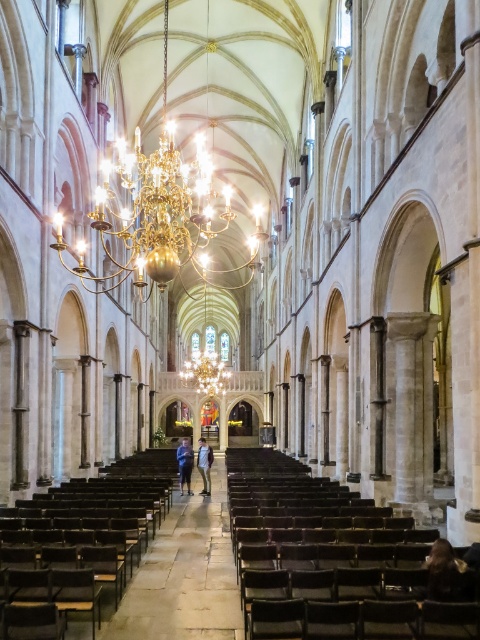
You are a visitor standing at the entrance of the cathedral. You see the brown wooden aisle at center and the blue denim jeans at center. Which object is bigger in size?

The brown wooden aisle at center is larger in size compared to the blue denim jeans at center.

You are standing in the cathedral and notice both the gold metallic chandelier at upper center and the light blue denim jeans at center. From your perspective, which object is located to the left?

The gold metallic chandelier at upper center is positioned on the left side of light blue denim jeans at center, so from your perspective, the gold metallic chandelier at upper center is to the left of the light blue denim jeans at center.

You are a visitor standing at the entrance of the cathedral. You notice the gold metallic chandelier at upper center and the light blue denim jeans at center. How far apart are these two items from each other?

The gold metallic chandelier at upper center and the light blue denim jeans at center are 44.30 meters apart.